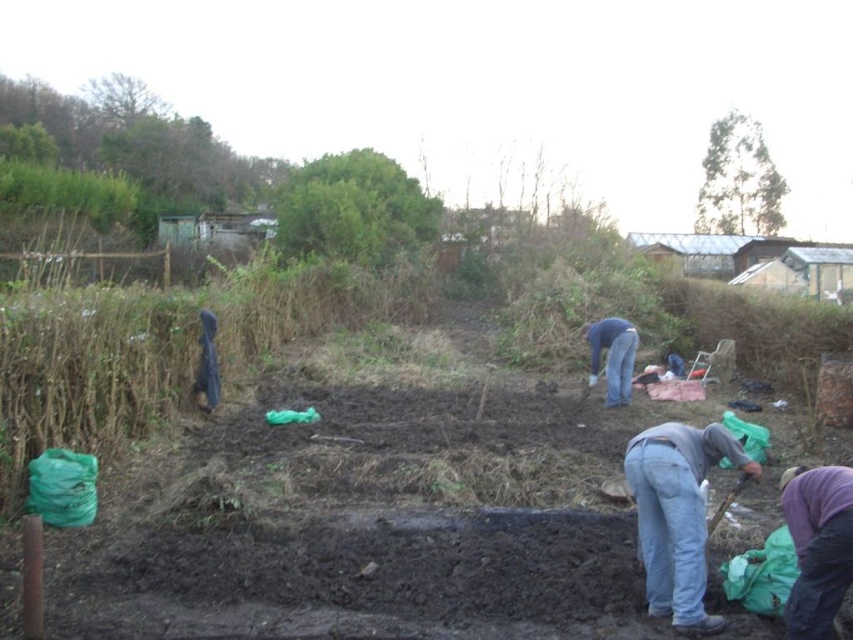
You are a gardener in the scene and need to decide which item to use first. The purple fabric at lower right and the wooden handle shovel at lower right are both in your vicinity. Which one is bigger and can be used as a temporary cover for a plant bed?

The purple fabric at lower right is larger in size than the wooden handle shovel at lower right, so it can be used as a temporary cover for a plant bed.

You are standing in the garden and need to hand a tool to the person wearing the gray cotton shirt at lower right and the blue jeans at center. Which person is closer to the ground based on their height?

The gray cotton shirt at lower right is shorter than the blue jeans at center, so the person wearing the gray cotton shirt at lower right is closer to the ground.